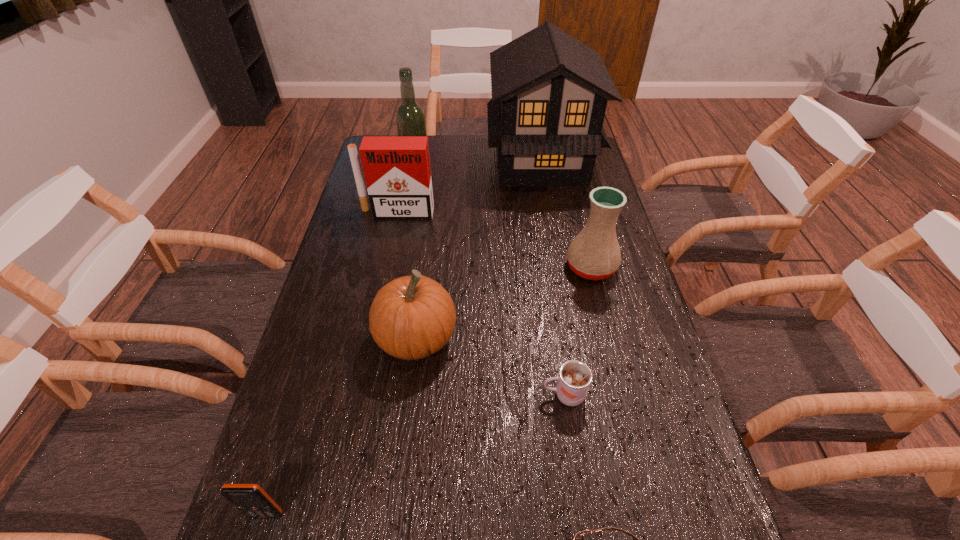
At what (x,y) coordinates should I click in order to perform the action: click on vacant area located on the front-facing side of the tallest object. Please return your answer as a coordinate pair (x, y). Image resolution: width=960 pixels, height=540 pixels. Looking at the image, I should click on (387, 162).

Identify the location of free space located on the front-facing side of the tallest object. point(432,162).

Locate an element on the screen. This screenshot has width=960, height=540. vacant space situated 0.150m on the left of the seventh shortest object is located at coordinates (363, 170).

Find the location of `vacant area situated on the front-facing side of the cigarette case`. vacant area situated on the front-facing side of the cigarette case is located at coordinates (378, 301).

Identify the location of vacant space situated on the left of the fifth nearest object. (438, 267).

Find the location of a particular element. vacant space located on the stem of the pumpkin is located at coordinates (557, 338).

Identify the location of blank space located on the side with the handle of the second shortest object. (378, 395).

The height and width of the screenshot is (540, 960). In order to click on vacant space located on the side with the handle of the second shortest object in this screenshot , I will do `click(405, 395)`.

I want to click on vacant area situated on the side with the handle of the second shortest object, so 365,395.

What are the coordinates of `dollhouse positioned at the far edge` in the screenshot? It's located at (549, 91).